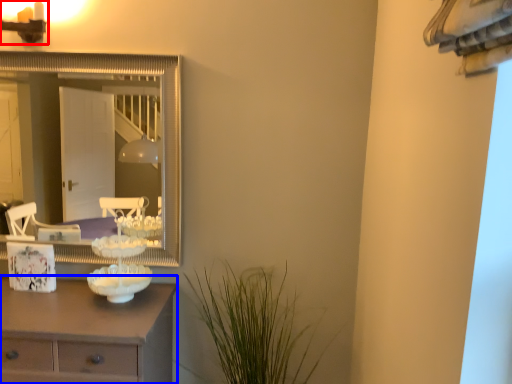
Question: Which object appears farthest to the camera in this image, light fixture (highlighted by a red box) or chest of drawers (highlighted by a blue box)?

Choices:
 (A) light fixture
 (B) chest of drawers

Answer: (A)